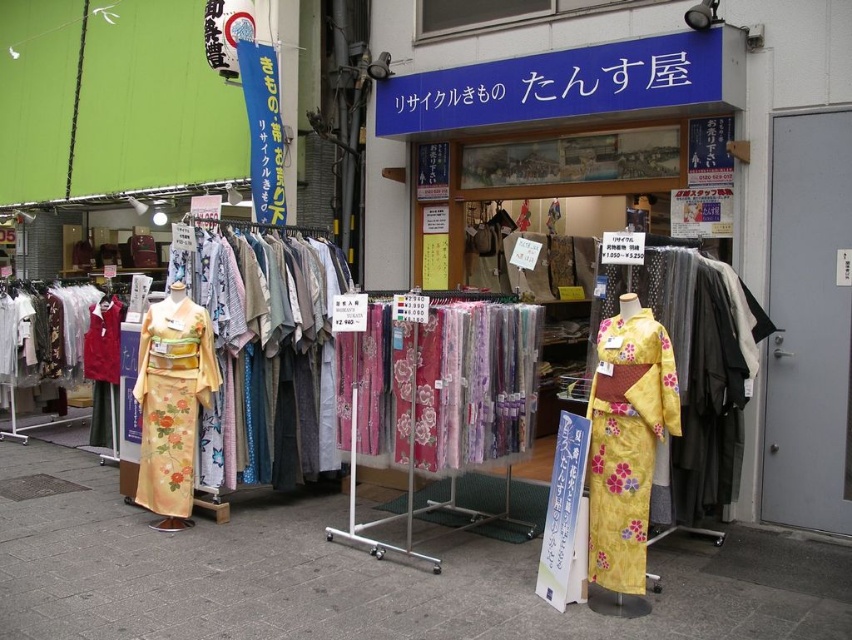
Question: Which of the following is the farthest from the observer?

Choices:
 (A) yellow floral silk kimono at center
 (B) floral silk kimono at center
 (C) yellow floral kimono at center
 (D) matte concrete pavement at center

Answer: (B)

Question: Can you confirm if floral silk kimono at center is thinner than yellow floral kimono at center?

Choices:
 (A) no
 (B) yes

Answer: (A)

Question: Can you confirm if matte concrete pavement at center is bigger than floral silk kimono at center?

Choices:
 (A) no
 (B) yes

Answer: (A)

Question: Can you confirm if floral silk kimono at center is positioned to the right of yellow floral kimono at center?

Choices:
 (A) yes
 (B) no

Answer: (B)

Question: Which of the following is the closest to the observer?

Choices:
 (A) yellow floral silk kimono at center
 (B) yellow floral kimono at center

Answer: (B)

Question: Which of these objects is positioned farthest from the matte concrete pavement at center?

Choices:
 (A) yellow floral silk kimono at center
 (B) yellow floral kimono at center
 (C) floral silk kimono at center

Answer: (B)